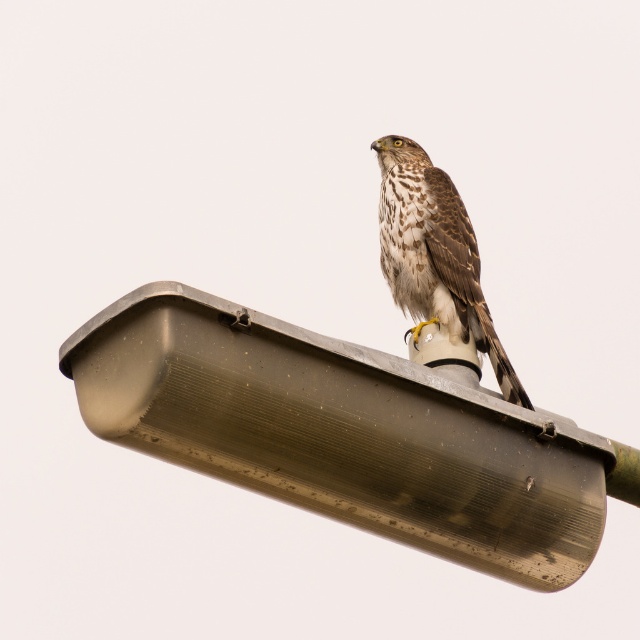
You are observing a bird on a lamp post. The bird has brown speckled feathers at upper center and is perched on a metallic gray lamp post at upper center. From the perspective of someone standing directly in front of the lamp post, which object is more to the left?

The metallic gray lamp post at upper center is positioned on the left side of the brown speckled feathers at upper center, so from the front view, the metallic gray lamp post at upper center is more to the left.

You are a birdwatcher observing a hawk perched on a streetlight. You notice the metallic gray lamp post at upper center and the brown speckled feathers at upper center. Which object is taller?

The brown speckled feathers at upper center are taller than the metallic gray lamp post at upper center.